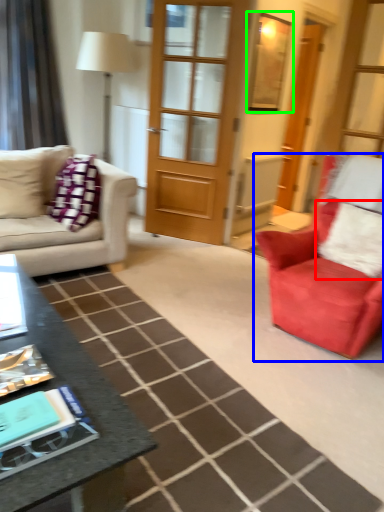
Question: Based on their relative distances, which object is farther from pillow (highlighted by a red box)? Choose from chair (highlighted by a blue box) and window screen (highlighted by a green box).

Choices:
 (A) chair
 (B) window screen

Answer: (B)